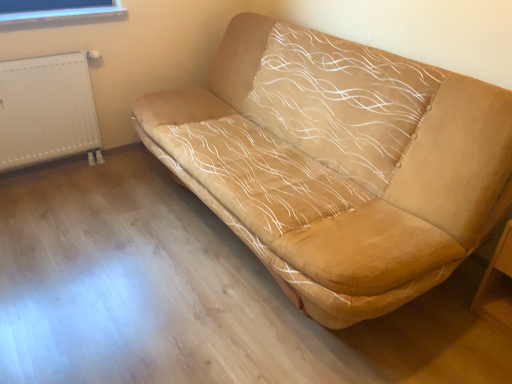
Find the location of `free area in between suede-like beige sofa at center and white plastic radiator at left`. free area in between suede-like beige sofa at center and white plastic radiator at left is located at coordinates (134, 231).